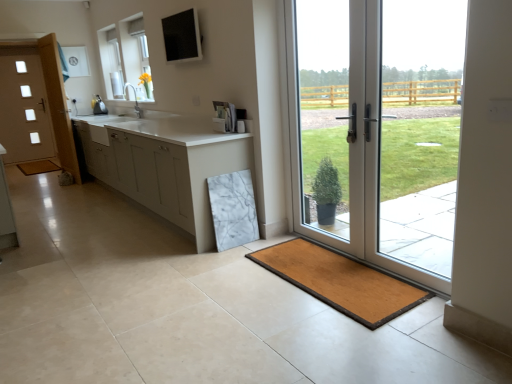
This screenshot has width=512, height=384. I want to click on vacant position to the left of brown rubber bath mat at lower right, the 2th bath mat from the back, so click(x=201, y=292).